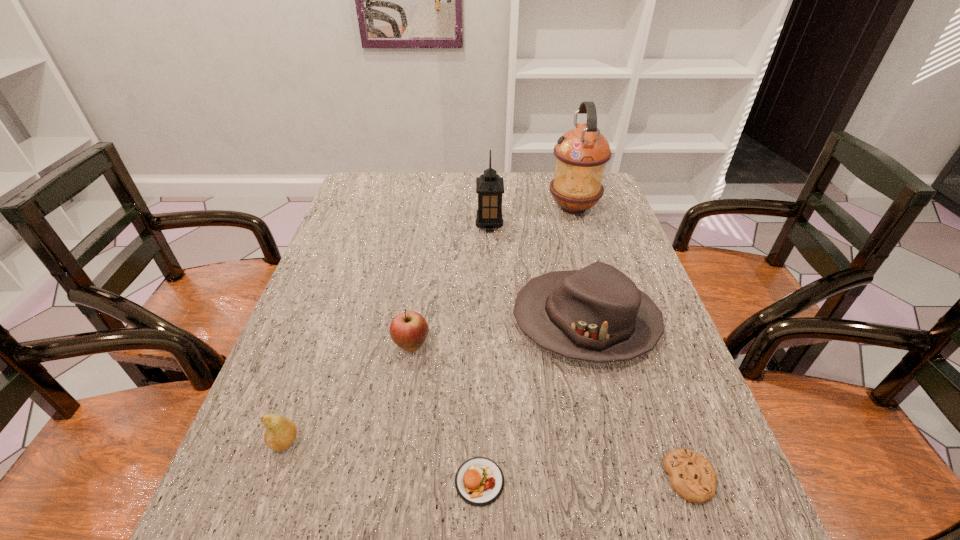
Locate an element on the screen. This screenshot has height=540, width=960. free space located 0.140m on the decorative side of the hat is located at coordinates (455, 321).

At what (x,y) coordinates should I click in order to perform the action: click on vacant space located 0.190m on the decorative side of the hat. Please return your answer as a coordinate pair (x, y). The image size is (960, 540). Looking at the image, I should click on (434, 321).

This screenshot has width=960, height=540. I want to click on vacant space located on the back of the second object from left to right, so click(420, 294).

This screenshot has height=540, width=960. In order to click on free space located 0.060m on the right of the leftmost object in this screenshot , I will do `click(331, 441)`.

This screenshot has width=960, height=540. I want to click on vacant region located on the right of the patty (food), so [718, 481].

The height and width of the screenshot is (540, 960). Find the location of `vacant space located 0.350m on the left of the cookie`. vacant space located 0.350m on the left of the cookie is located at coordinates (469, 478).

At what (x,y) coordinates should I click in order to perform the action: click on object that is at the far edge. Please return your answer as a coordinate pair (x, y). Looking at the image, I should click on (581, 154).

Locate an element on the screen. object present at the left edge is located at coordinates (280, 433).

Locate an element on the screen. The width and height of the screenshot is (960, 540). oil lamp located at the right edge is located at coordinates (581, 154).

I want to click on hat present at the right edge, so click(597, 314).